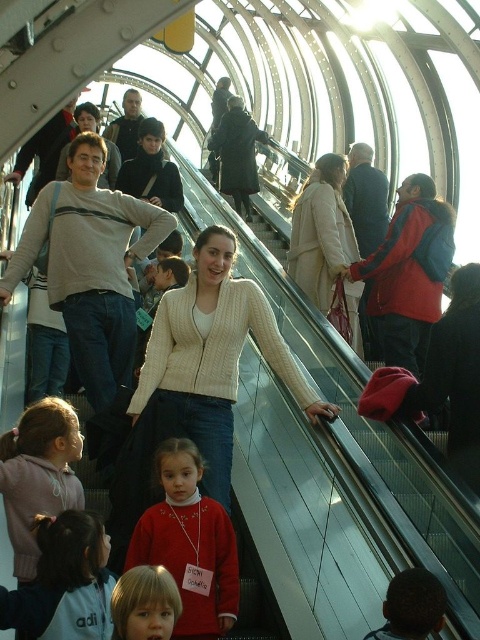
You are a person standing on the escalator and you want to move past the pink fleece jacket at lower left and the matte red sweater at lower center to get off the escalator. Which one do you need to move around first?

You need to move around the pink fleece jacket at lower left first because it might be wider than the matte red sweater at lower center, so you need to navigate around it before proceeding to the matte red sweater at lower center.